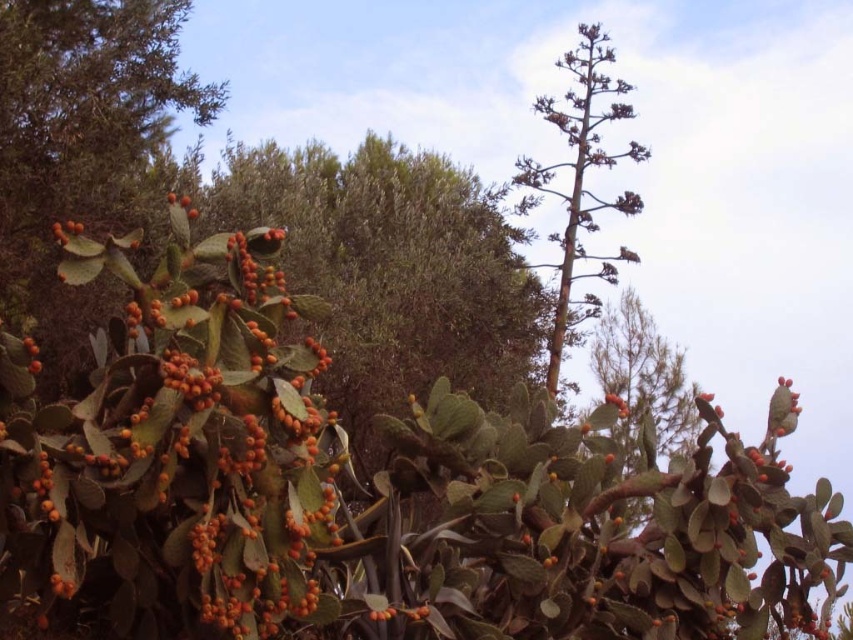
Is green leafy tree at upper right shorter than orange matte cactus fruit at center-right?

No.

Between green leafy tree at upper right and orange matte cactus fruit at center-right, which one is positioned higher?

green leafy tree at upper right

Who is more forward, [582,308] or [613,404]?

Point [613,404] is in front.

Locate an element on the screen. The height and width of the screenshot is (640, 853). green leafy tree at upper right is located at coordinates (579, 177).

Is orange matte cactus fruit at center-left thinner than orange matte cactus fruit at left?

Correct, orange matte cactus fruit at center-left's width is less than orange matte cactus fruit at left's.

Looking at this image, between orange matte cactus fruit at center-left and orange matte cactus fruit at left, which one appears on the right side from the viewer's perspective?

orange matte cactus fruit at center-left

Does point (173, 374) lie in front of point (54, 230)?

Yes, point (173, 374) is in front of point (54, 230).

Where is `orange matte cactus fruit at center-left`? orange matte cactus fruit at center-left is located at coordinates (190, 378).

Based on the photo, can you confirm if green leafy tree at upper right is bigger than orange matte cactus fruit at center-left?

Yes.

Who is more distant from viewer, (608, 122) or (196, 362)?

Point (608, 122)

Locate an element on the screen. The image size is (853, 640). green leafy tree at upper right is located at coordinates (579, 177).